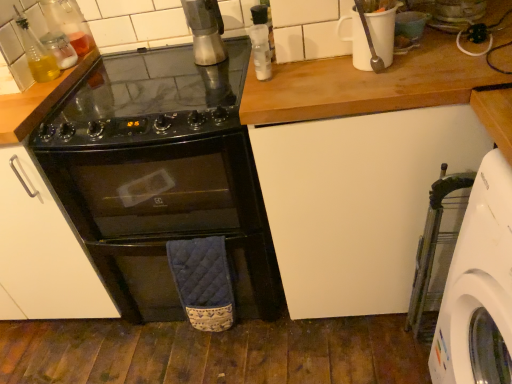
Where is `vacant area that is in front of translucent glass bottle at upper left, the 3th bottle from the right`? Image resolution: width=512 pixels, height=384 pixels. vacant area that is in front of translucent glass bottle at upper left, the 3th bottle from the right is located at coordinates click(x=19, y=93).